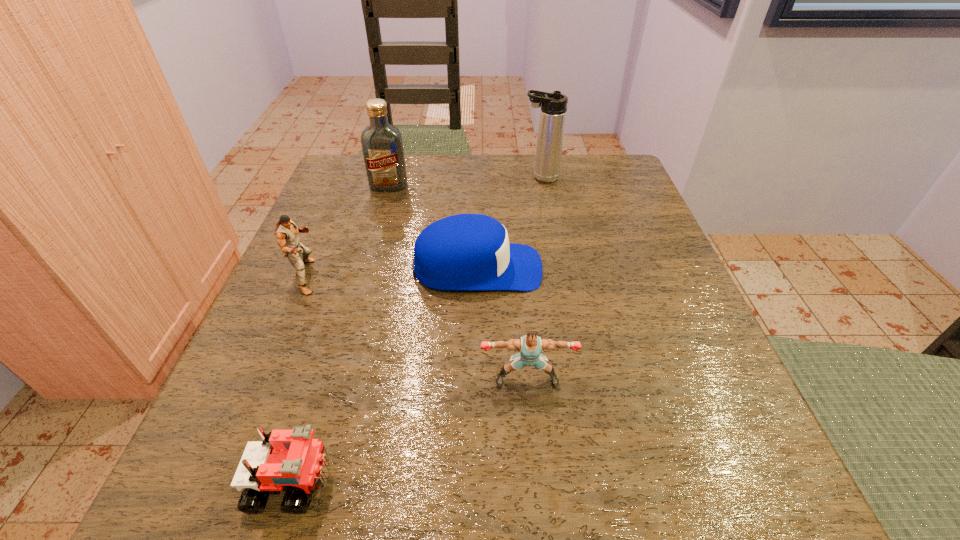
Locate an element on the screen. Image resolution: width=960 pixels, height=540 pixels. vacant space that satisfies the following two spatial constraints: 1. on the front-facing side of the vodka; 2. on the front-facing side of the nearest object is located at coordinates (305, 481).

At what (x,y) coordinates should I click in order to perform the action: click on free space in the image that satisfies the following two spatial constraints: 1. on the front-facing side of the right puncher; 2. on the front-facing side of the Lego. Please return your answer as a coordinate pair (x, y). Image resolution: width=960 pixels, height=540 pixels. Looking at the image, I should click on (536, 481).

Locate an element on the screen. free location that satisfies the following two spatial constraints: 1. on the front-facing side of the vodka; 2. on the front-facing side of the farther puncher is located at coordinates (x=363, y=276).

Where is `vacant space that satisfies the following two spatial constraints: 1. on the handle side of the thermos bottle; 2. on the front-facing side of the right puncher`? vacant space that satisfies the following two spatial constraints: 1. on the handle side of the thermos bottle; 2. on the front-facing side of the right puncher is located at coordinates (579, 380).

Where is `free location that satisfies the following two spatial constraints: 1. on the handle side of the thermos bottle; 2. on the front-facing side of the second nearest object`? This screenshot has width=960, height=540. free location that satisfies the following two spatial constraints: 1. on the handle side of the thermos bottle; 2. on the front-facing side of the second nearest object is located at coordinates (579, 380).